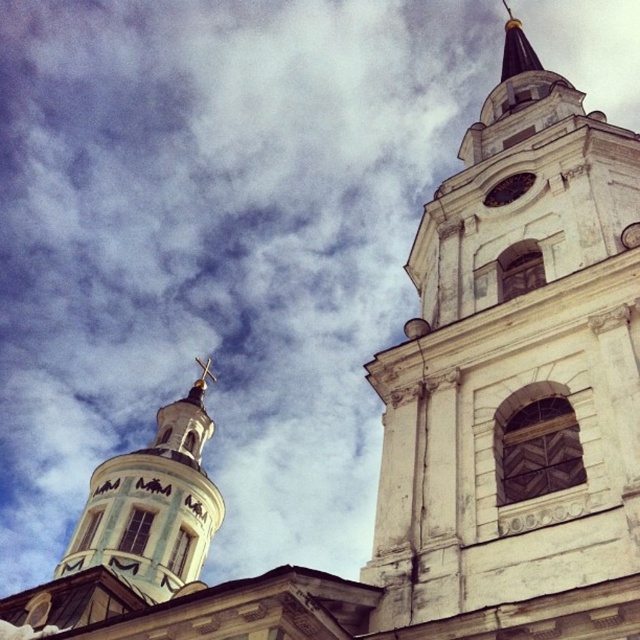
You are an architect analyzing the spatial relationships in the image. You need to determine which object occupies more space in the visual field. Based on the scene description, which one is bigger between the white painted wood tower at upper left and the matte white clock at upper center?

The white painted wood tower at upper left is larger in size compared to the matte white clock at upper center, so it occupies more space in the visual field.